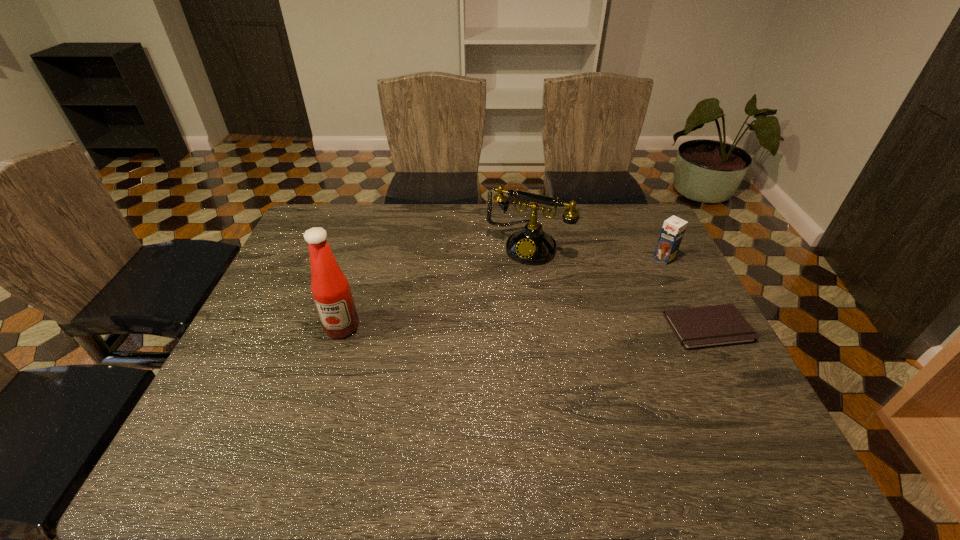
Locate an element on the screen. The image size is (960, 540). vacant space at the near left corner of the desktop is located at coordinates (212, 423).

Where is `free space between the second shortest object and the leftmost object`? free space between the second shortest object and the leftmost object is located at coordinates (503, 293).

The image size is (960, 540). Identify the location of vacant area that lies between the leftmost object and the shortest object. (525, 328).

What are the coordinates of `vacant area between the condiment and the chocolate milk` in the screenshot? It's located at (503, 293).

Find the location of a particular element. This screenshot has height=540, width=960. vacant space that's between the condiment and the second shortest object is located at coordinates (503, 293).

Find the location of a particular element. The height and width of the screenshot is (540, 960). vacant point located between the condiment and the third tallest object is located at coordinates [503, 293].

You are a GUI agent. You are given a task and a screenshot of the screen. Output one action in this format:
    pyautogui.click(x=<x>, y=<y>)
    Task: Click on the vacant area between the third shortest object and the second shortest object
    Image resolution: width=960 pixels, height=540 pixels.
    Given the screenshot: What is the action you would take?
    pyautogui.click(x=596, y=252)

At what (x,y) coordinates should I click in order to perform the action: click on blank region between the chocolate milk and the checkbook. Please return your answer as a coordinate pair (x, y). Looking at the image, I should click on (686, 293).

In order to click on free point between the tallest object and the checkbook in this screenshot , I will do `click(525, 328)`.

Locate an element on the screen. vacant space that is in between the third object from right to left and the tallest object is located at coordinates (435, 286).